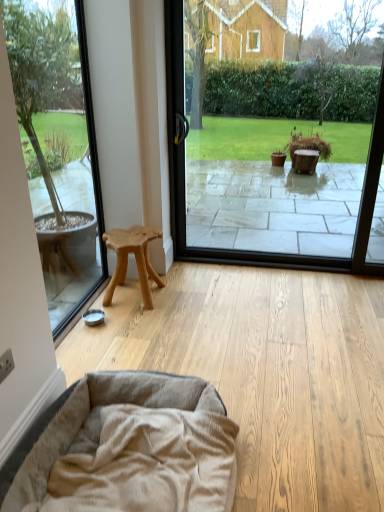
Question: Is beige plush dog bed at lower left surrounded by transparent glass window at center, which is counted as the first window screen, starting from the right?

Choices:
 (A) yes
 (B) no

Answer: (B)

Question: Is transparent glass window at center, which is counted as the first window screen, starting from the right, facing towards beige plush dog bed at lower left?

Choices:
 (A) no
 (B) yes

Answer: (B)

Question: Can you confirm if transparent glass window at center, which is the second window screen in left-to-right order, is smaller than beige plush dog bed at lower left?

Choices:
 (A) yes
 (B) no

Answer: (B)

Question: Is transparent glass window at center, which is the second window screen in left-to-right order, wider than beige plush dog bed at lower left?

Choices:
 (A) no
 (B) yes

Answer: (A)

Question: From the image's perspective, is transparent glass window at center, which is the second window screen in left-to-right order, above beige plush dog bed at lower left?

Choices:
 (A) no
 (B) yes

Answer: (B)

Question: Considering their positions, is natural wood stool at left located in front of or behind transparent glass window at left, positioned as the 1th window screen in left-to-right order?

Choices:
 (A) front
 (B) behind

Answer: (B)

Question: Is point (120, 253) closer or farther from the camera than point (13, 58)?

Choices:
 (A) closer
 (B) farther

Answer: (B)

Question: Is natural wood stool at left taller or shorter than transparent glass window at left, positioned as the 1th window screen in left-to-right order?

Choices:
 (A) tall
 (B) short

Answer: (B)

Question: From the image's perspective, is natural wood stool at left located above or below transparent glass window at left, positioned as the 1th window screen in left-to-right order?

Choices:
 (A) above
 (B) below

Answer: (B)

Question: In the image, is transparent glass window at left, positioned as the 1th window screen in left-to-right order, positioned in front of or behind beige plush dog bed at lower left?

Choices:
 (A) behind
 (B) front

Answer: (A)

Question: Is point (57, 30) positioned closer to the camera than point (170, 391)?

Choices:
 (A) farther
 (B) closer

Answer: (A)

Question: From the image's perspective, relative to beige plush dog bed at lower left, is transparent glass window at left, positioned as the 1th window screen in left-to-right order, above or below?

Choices:
 (A) below
 (B) above

Answer: (B)

Question: Based on their positions, is transparent glass window at left, which is the 2th window screen in right-to-left order, located to the left or right of beige plush dog bed at lower left?

Choices:
 (A) right
 (B) left

Answer: (B)

Question: From the image's perspective, relative to transparent glass window at center, which is the second window screen in left-to-right order, is natural wood stool at left above or below?

Choices:
 (A) below
 (B) above

Answer: (A)

Question: Is point (127, 254) positioned closer to the camera than point (334, 252)?

Choices:
 (A) closer
 (B) farther

Answer: (A)